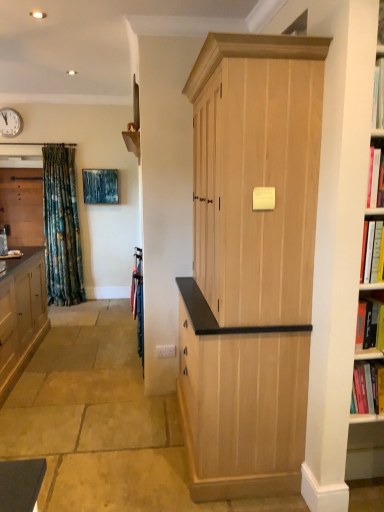
Question: In the image, is matte wood cabinet at left, placed as the 2th cabinetry when sorted from front to back, positioned in front of or behind wooden shelf at upper center?

Choices:
 (A) behind
 (B) front

Answer: (B)

Question: Visually, is matte wood cabinet at left, positioned as the 2th cabinetry in right-to-left order, positioned to the left or to the right of wooden shelf at upper center?

Choices:
 (A) left
 (B) right

Answer: (A)

Question: Based on their relative distances, which object is farther from the matte wood cabinet at left, the third cabinetry when ordered from front to back?

Choices:
 (A) metallic wall clock at upper left
 (B) natural wood cabinet at center, which is counted as the first cabinetry, starting from the right
 (C) wooden shelf at upper center
 (D) matte wood cabinet at left, positioned as the 2th cabinetry in left-to-right order

Answer: (B)

Question: Which object is the closest to the natural wood cabinet at center, arranged as the third cabinetry when viewed from the back?

Choices:
 (A) matte wood cabinet at left, placed as the 2th cabinetry when sorted from front to back
 (B) matte wood cabinet at left, the third cabinetry when ordered from front to back
 (C) wooden shelf at upper center
 (D) metallic wall clock at upper left

Answer: (C)